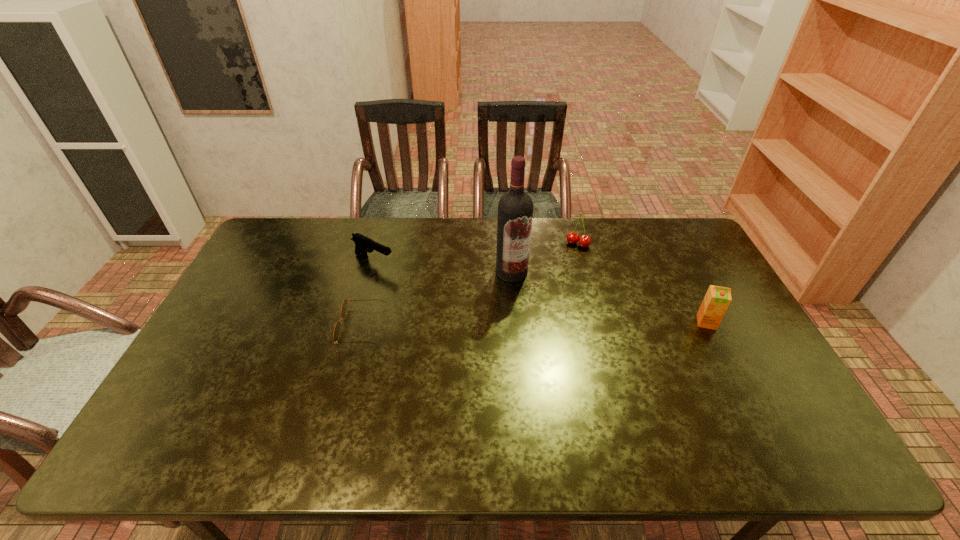
The height and width of the screenshot is (540, 960). I want to click on vacant space located 0.320m on the label of the wine bottle, so click(x=522, y=363).

In order to click on pistol situated at the far edge in this screenshot , I will do `click(363, 244)`.

Locate an element on the screen. cherry that is at the far edge is located at coordinates (584, 241).

What are the coordinates of `object that is at the right edge` in the screenshot? It's located at (717, 299).

Locate an element on the screen. This screenshot has width=960, height=540. vacant space at the far edge of the desktop is located at coordinates (581, 227).

In the image, there is a desktop. Find the location of `vacant region at the near edge`. vacant region at the near edge is located at coordinates (453, 388).

Locate an element on the screen. free region at the left edge is located at coordinates (295, 260).

Find the location of `free space at the right edge`. free space at the right edge is located at coordinates (773, 387).

You are a GUI agent. You are given a task and a screenshot of the screen. Output one action in this format:
    pyautogui.click(x=<x>, y=<y>)
    Task: Click on the blank space at the far left corner of the desktop
    Image resolution: width=960 pixels, height=540 pixels.
    Given the screenshot: What is the action you would take?
    pyautogui.click(x=272, y=235)

You are a GUI agent. You are given a task and a screenshot of the screen. Output one action in this format:
    pyautogui.click(x=<x>, y=<y>)
    Task: Click on the free space at the far right corner
    Image resolution: width=960 pixels, height=540 pixels.
    Given the screenshot: What is the action you would take?
    pyautogui.click(x=648, y=234)